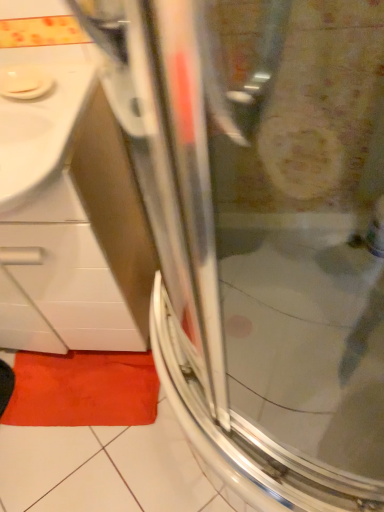
Question: Is point (34, 58) positioned closer to the camera than point (99, 354)?

Choices:
 (A) closer
 (B) farther

Answer: (A)

Question: In the image, is white glossy sink at upper left on the left side or the right side of orange fabric bath mat at lower left?

Choices:
 (A) right
 (B) left

Answer: (B)

Question: Looking at the image, does white glossy sink at upper left seem bigger or smaller compared to orange fabric bath mat at lower left?

Choices:
 (A) big
 (B) small

Answer: (A)

Question: Is point (87, 368) closer or farther from the camera than point (6, 97)?

Choices:
 (A) closer
 (B) farther

Answer: (B)

Question: Is orange fabric bath mat at lower left situated inside white glossy sink at upper left or outside?

Choices:
 (A) outside
 (B) inside

Answer: (A)

Question: Considering the relative positions of orange fabric bath mat at lower left and white glossy sink at upper left in the image provided, is orange fabric bath mat at lower left to the left or to the right of white glossy sink at upper left?

Choices:
 (A) right
 (B) left

Answer: (A)

Question: In terms of size, does orange fabric bath mat at lower left appear bigger or smaller than white glossy sink at upper left?

Choices:
 (A) small
 (B) big

Answer: (A)